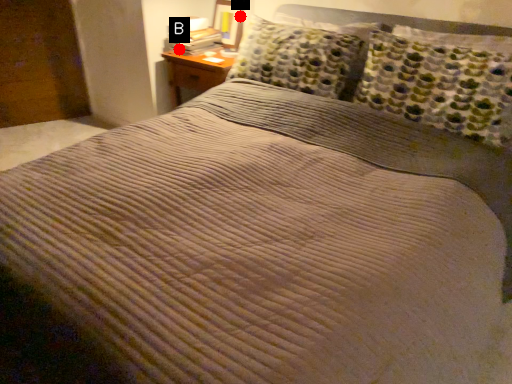
Question: Two points are circled on the image, labeled by A and B beside each circle. Which of the following is the farthest from the observer?

Choices:
 (A) A is further
 (B) B is further

Answer: (A)